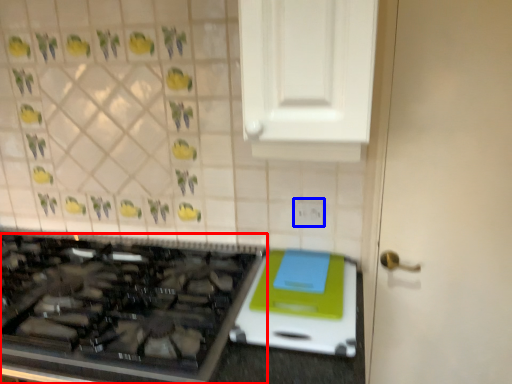
Question: Which of the following is the farthest to the observer, gas stove (highlighted by a red box) or electric outlet (highlighted by a blue box)?

Choices:
 (A) gas stove
 (B) electric outlet

Answer: (B)